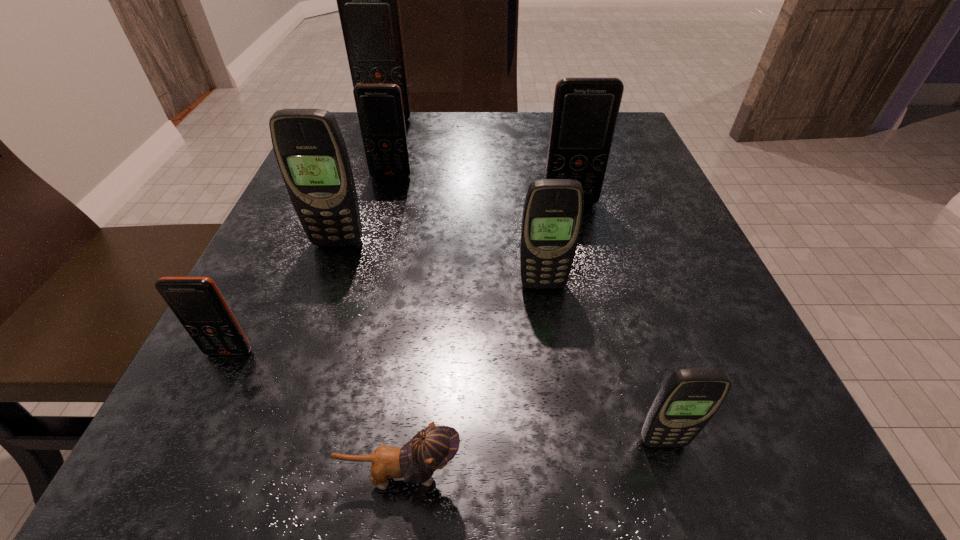
Identify the location of the tallest object. Image resolution: width=960 pixels, height=540 pixels. (368, 0).

The width and height of the screenshot is (960, 540). I want to click on the farthest cellular telephone, so click(x=368, y=0).

Where is `the fifth nearest cellular telephone`? the fifth nearest cellular telephone is located at coordinates (585, 110).

Identify the location of the rightmost orange cellular telephone. (585, 110).

Identify the location of the biggest gray cellular telephone. This screenshot has height=540, width=960. tap(311, 153).

The width and height of the screenshot is (960, 540). Identify the location of the farthest gray cellular telephone. (311, 153).

Image resolution: width=960 pixels, height=540 pixels. Find the location of `the second biggest gray cellular telephone`. the second biggest gray cellular telephone is located at coordinates (552, 215).

Where is `the fifth farthest cellular telephone`? Image resolution: width=960 pixels, height=540 pixels. the fifth farthest cellular telephone is located at coordinates (552, 215).

I want to click on the second farthest cellular telephone, so click(379, 107).

Identify the location of the seventh nearest object. (379, 107).